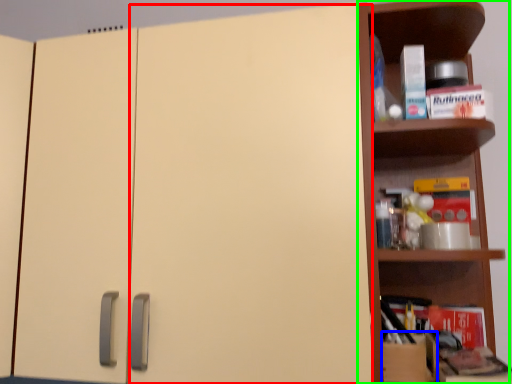
Question: Which object is positioned closest to door (highlighted by a red box)? Select from cardboard box (highlighted by a blue box) and shelf (highlighted by a green box).

Choices:
 (A) cardboard box
 (B) shelf

Answer: (B)